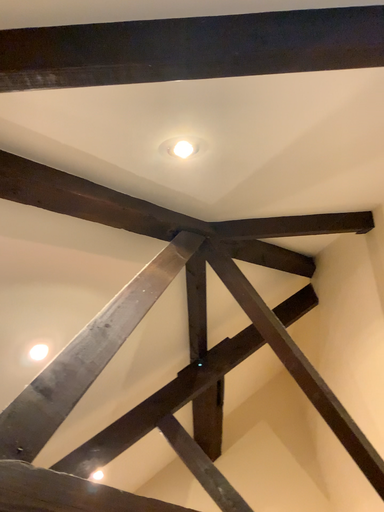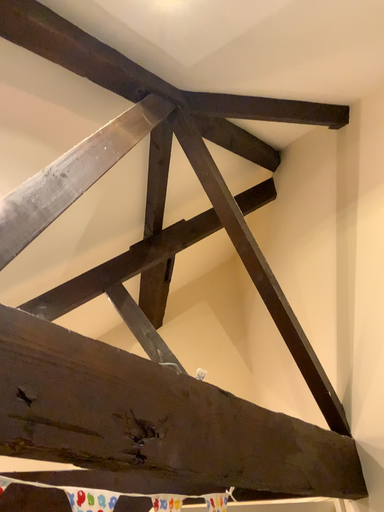
Question: Which way did the camera rotate in the video?

Choices:
 (A) rotated upward
 (B) rotated downward

Answer: (B)